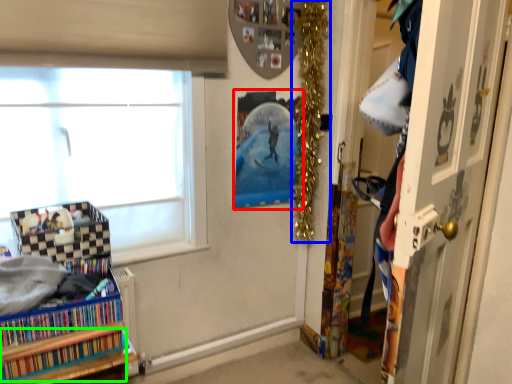
Question: Estimate the real-world distances between objects in this image. Which object is closer to picture frame (highlighted by a red box), christmas decoration (highlighted by a blue box) or book (highlighted by a green box)?

Choices:
 (A) christmas decoration
 (B) book

Answer: (A)